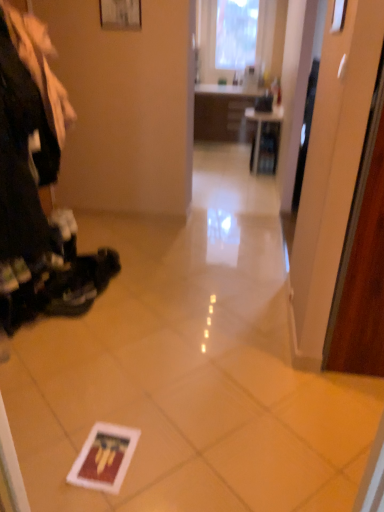
Question: Is matte black shelf at center to the left or to the right of matte white picture frame at upper center in the image?

Choices:
 (A) right
 (B) left

Answer: (A)

Question: In the image, is matte black shelf at center positioned in front of or behind matte white picture frame at upper center?

Choices:
 (A) front
 (B) behind

Answer: (B)

Question: Considering the positions of matte black shelf at center and matte white picture frame at upper center in the image, is matte black shelf at center wider or thinner than matte white picture frame at upper center?

Choices:
 (A) wide
 (B) thin

Answer: (A)

Question: From a real-world perspective, is matte white picture frame at upper center physically located above or below matte black shelf at center?

Choices:
 (A) above
 (B) below

Answer: (A)

Question: Visually, is matte white picture frame at upper center positioned to the left or to the right of matte black shelf at center?

Choices:
 (A) left
 (B) right

Answer: (A)

Question: Is matte white picture frame at upper center in front of or behind matte black shelf at center in the image?

Choices:
 (A) behind
 (B) front

Answer: (B)

Question: Is matte white picture frame at upper center wider or thinner than matte black shelf at center?

Choices:
 (A) wide
 (B) thin

Answer: (B)